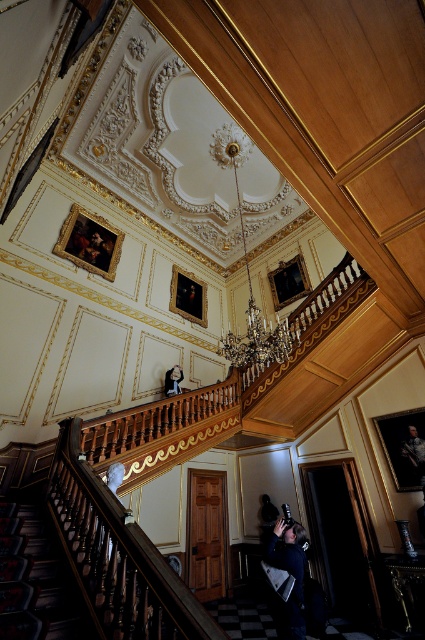
You are an interior designer planning to place a new decorative item between the dark wood stairwell at lower left and the smooth white statue at center. Based on their positions, which object should the new item be closer to?

The dark wood stairwell at lower left is positioned on the left side of the smooth white statue at center, so the new decorative item should be placed closer to the dark wood stairwell at lower left to maintain symmetry or balance in the space.